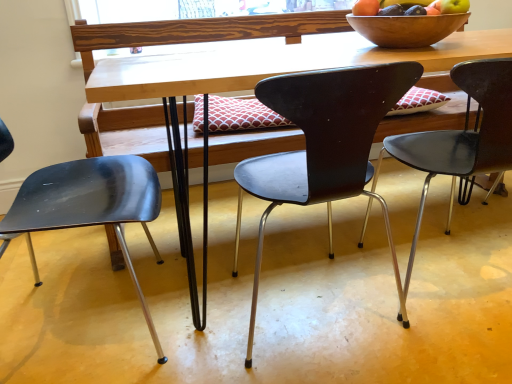
The width and height of the screenshot is (512, 384). What are the coordinates of `free point behind matte black chair at center, arranged as the 3th chair when viewed from the left` in the screenshot? It's located at (395, 217).